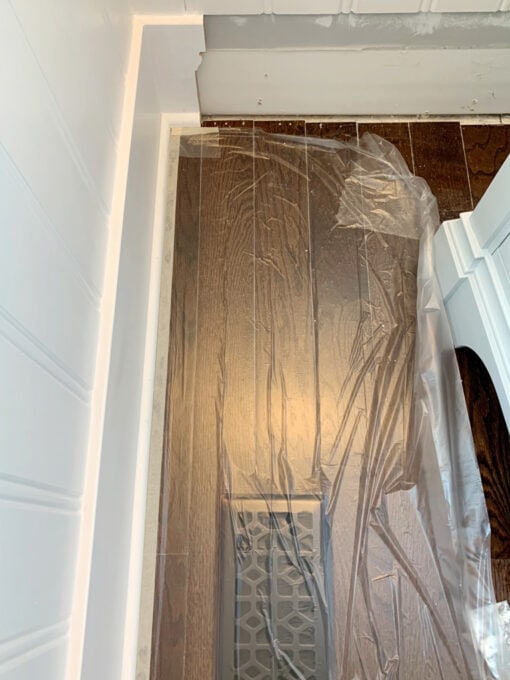
Identify the location of wall. This screenshot has height=680, width=510. (38, 255), (347, 5).